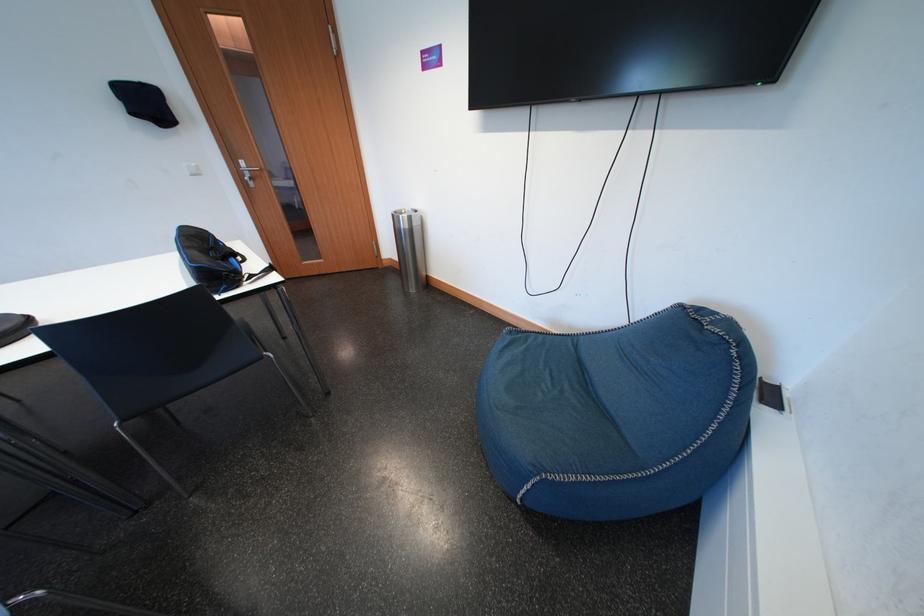
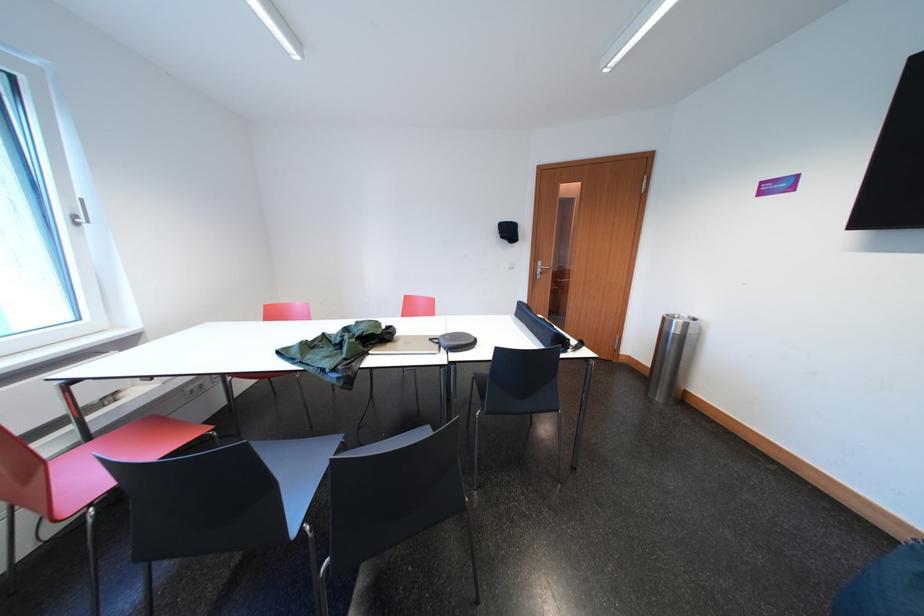
The point at (x=251, y=167) is marked in the first image. Where is the corresponding point in the second image?

(550, 268)